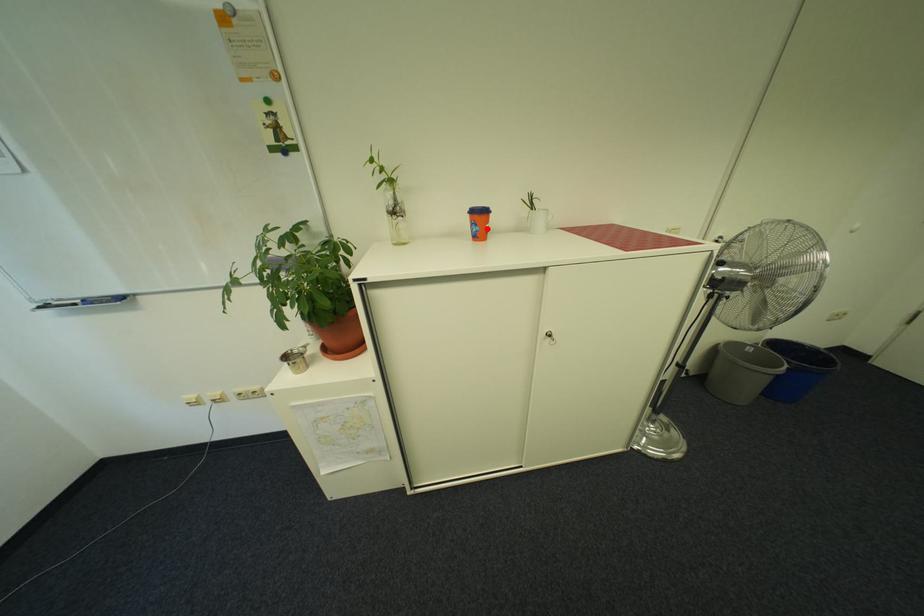
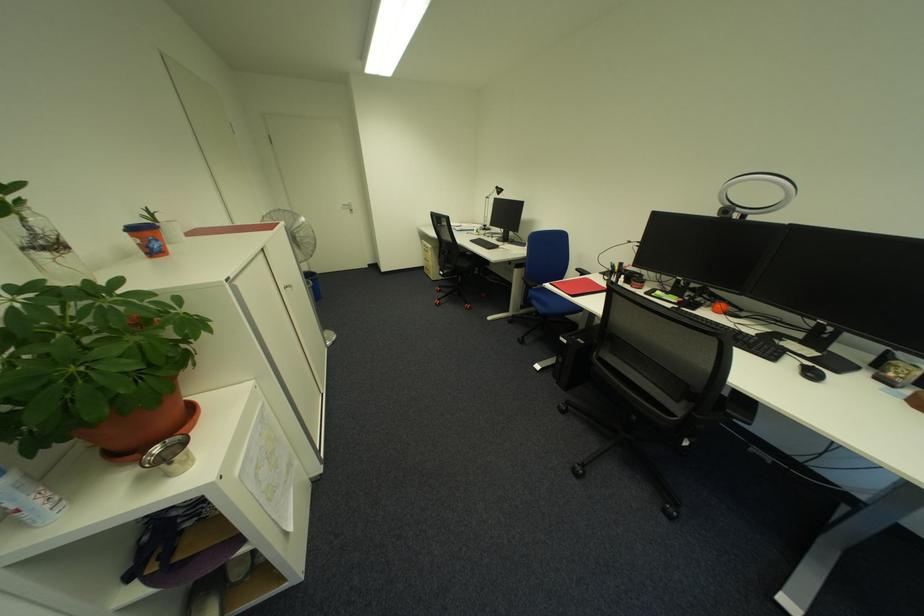
In the second image, find the point that corresponds to the highlighted location in the first image.

(169, 244)